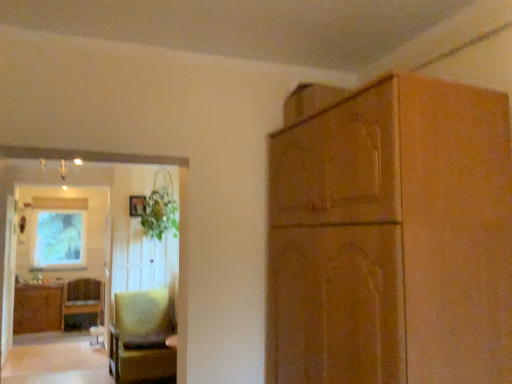
Question: Considering the relative sizes of matte green painting at upper left and woven wicker cabinet at lower left, arranged as the first cabinetry when ordered from the bottom, in the image provided, is matte green painting at upper left taller than woven wicker cabinet at lower left, arranged as the first cabinetry when ordered from the bottom,?

Choices:
 (A) no
 (B) yes

Answer: (B)

Question: Considering the relative positions of matte green painting at upper left and woven wicker cabinet at lower left, the 1th cabinetry from the left, in the image provided, is matte green painting at upper left behind woven wicker cabinet at lower left, the 1th cabinetry from the left,?

Choices:
 (A) yes
 (B) no

Answer: (A)

Question: Is matte green painting at upper left looking in the opposite direction of woven wicker cabinet at lower left, which is the 2th cabinetry from right to left?

Choices:
 (A) no
 (B) yes

Answer: (A)

Question: Could you tell me if matte green painting at upper left is turned towards woven wicker cabinet at lower left, the 2th cabinetry positioned from the front?

Choices:
 (A) no
 (B) yes

Answer: (A)

Question: Does matte green painting at upper left lie in front of woven wicker cabinet at lower left, which is the 2th cabinetry from right to left?

Choices:
 (A) yes
 (B) no

Answer: (B)

Question: Can you confirm if matte green painting at upper left is thinner than woven wicker cabinet at lower left, which is the 2th cabinetry from right to left?

Choices:
 (A) yes
 (B) no

Answer: (A)

Question: Considering the relative sizes of velvet yellow chair at lower left, which appears as the second chair when viewed from the back, and green leafy plant at upper left in the image provided, is velvet yellow chair at lower left, which appears as the second chair when viewed from the back, smaller than green leafy plant at upper left?

Choices:
 (A) no
 (B) yes

Answer: (A)

Question: From a real-world perspective, is velvet yellow chair at lower left, which is the 1th chair from right to left, positioned under green leafy plant at upper left based on gravity?

Choices:
 (A) no
 (B) yes

Answer: (B)

Question: Does velvet yellow chair at lower left, which is the 1th chair from right to left, come in front of green leafy plant at upper left?

Choices:
 (A) yes
 (B) no

Answer: (A)

Question: Is green leafy plant at upper left a part of velvet yellow chair at lower left, which is the 1th chair from right to left?

Choices:
 (A) no
 (B) yes

Answer: (A)

Question: Can you confirm if velvet yellow chair at lower left, which appears as the second chair when viewed from the back, is shorter than green leafy plant at upper left?

Choices:
 (A) yes
 (B) no

Answer: (A)

Question: From a real-world perspective, is velvet yellow chair at lower left, which appears as the second chair when viewed from the back, located higher than green leafy plant at upper left?

Choices:
 (A) yes
 (B) no

Answer: (B)

Question: Is woven wicker cabinet at lower left, arranged as the first cabinetry when ordered from the bottom, completely or partially outside of matte green painting at upper left?

Choices:
 (A) no
 (B) yes

Answer: (B)